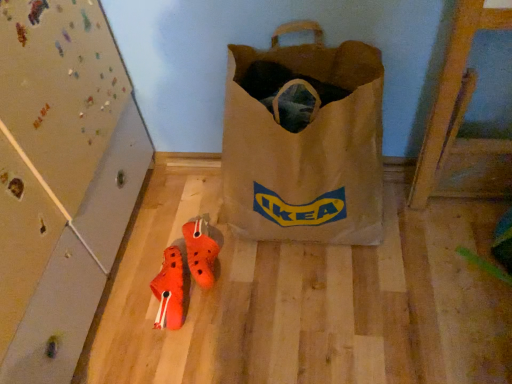
Find the location of a particular element. The image size is (512, 384). brown paper bag at center is located at coordinates (306, 148).

Considering the relative positions of brown paper bag at center and orange rubber clogs at center, the 1th footwear viewed from the right, in the image provided, is brown paper bag at center to the left or to the right of orange rubber clogs at center, the 1th footwear viewed from the right,?

brown paper bag at center is positioned on orange rubber clogs at center, the 1th footwear viewed from the right,'s right side.

Between brown paper bag at center and orange rubber clogs at center, the 2th footwear from the left, which one is positioned behind?

Positioned behind is orange rubber clogs at center, the 2th footwear from the left.

From the image's perspective, which one is positioned higher, brown paper bag at center or orange rubber clogs at center, the 1th footwear viewed from the right?

From the image's view, brown paper bag at center is above.

Identify the location of luggage and bags on the right of orange matte sneakers at lower center, arranged as the first footwear when viewed from the left. This screenshot has height=384, width=512. (306, 148).

Is brown paper bag at center positioned with its back to orange matte sneakers at lower center, placed as the second footwear when sorted from right to left?

brown paper bag at center does not have its back to orange matte sneakers at lower center, placed as the second footwear when sorted from right to left.

Which is more to the right, brown paper bag at center or orange matte sneakers at lower center, arranged as the first footwear when viewed from the left?

Positioned to the right is brown paper bag at center.

Considering the relative sizes of orange rubber clogs at center, the 2th footwear from the left, and orange matte sneakers at lower center, arranged as the first footwear when viewed from the left, in the image provided, is orange rubber clogs at center, the 2th footwear from the left, shorter than orange matte sneakers at lower center, arranged as the first footwear when viewed from the left,?

Yes.

Which is in front, orange rubber clogs at center, the 2th footwear from the left, or orange matte sneakers at lower center, arranged as the first footwear when viewed from the left?

Positioned in front is orange matte sneakers at lower center, arranged as the first footwear when viewed from the left.

Can we say orange rubber clogs at center, the 2th footwear from the left, lies outside orange matte sneakers at lower center, arranged as the first footwear when viewed from the left?

Absolutely, orange rubber clogs at center, the 2th footwear from the left, is external to orange matte sneakers at lower center, arranged as the first footwear when viewed from the left.

Is orange rubber clogs at center, the 2th footwear from the left, with orange matte sneakers at lower center, placed as the second footwear when sorted from right to left?

Yes, orange rubber clogs at center, the 2th footwear from the left, is beside orange matte sneakers at lower center, placed as the second footwear when sorted from right to left.

Looking at this image, is orange matte sneakers at lower center, arranged as the first footwear when viewed from the left, not inside brown paper bag at center?

Yes, orange matte sneakers at lower center, arranged as the first footwear when viewed from the left, is outside of brown paper bag at center.

Is orange matte sneakers at lower center, placed as the second footwear when sorted from right to left, positioned with its back to brown paper bag at center?

No, orange matte sneakers at lower center, placed as the second footwear when sorted from right to left,'s orientation is not away from brown paper bag at center.

Measure the distance from orange matte sneakers at lower center, arranged as the first footwear when viewed from the left, to brown paper bag at center.

orange matte sneakers at lower center, arranged as the first footwear when viewed from the left, is 15.94 inches from brown paper bag at center.

Which is more to the left, orange matte sneakers at lower center, placed as the second footwear when sorted from right to left, or brown paper bag at center?

orange matte sneakers at lower center, placed as the second footwear when sorted from right to left, is more to the left.

Does orange matte sneakers at lower center, placed as the second footwear when sorted from right to left, have a lesser height compared to orange rubber clogs at center, the 1th footwear viewed from the right?

Incorrect, the height of orange matte sneakers at lower center, placed as the second footwear when sorted from right to left, does not fall short of that of orange rubber clogs at center, the 1th footwear viewed from the right.

The width and height of the screenshot is (512, 384). There is a orange matte sneakers at lower center, placed as the second footwear when sorted from right to left. Identify the location of footwear above it (from a real-world perspective). (200, 251).

Does point (177, 287) lie behind point (201, 220)?

No, (177, 287) is in front of (201, 220).

Can you confirm if orange matte sneakers at lower center, arranged as the first footwear when viewed from the left, is positioned to the right of orange rubber clogs at center, the 2th footwear from the left?

No, orange matte sneakers at lower center, arranged as the first footwear when viewed from the left, is not to the right of orange rubber clogs at center, the 2th footwear from the left.

Does orange rubber clogs at center, the 2th footwear from the left, have a smaller size compared to brown paper bag at center?

Correct, orange rubber clogs at center, the 2th footwear from the left, occupies less space than brown paper bag at center.

Is orange rubber clogs at center, the 1th footwear viewed from the right, facing away from brown paper bag at center?

No, orange rubber clogs at center, the 1th footwear viewed from the right, is not facing away from brown paper bag at center.

Considering the sizes of orange rubber clogs at center, the 2th footwear from the left, and brown paper bag at center in the image, is orange rubber clogs at center, the 2th footwear from the left, wider or thinner than brown paper bag at center?

Clearly, orange rubber clogs at center, the 2th footwear from the left, has less width compared to brown paper bag at center.

Is orange rubber clogs at center, the 2th footwear from the left, at the left side of brown paper bag at center?

Correct, you'll find orange rubber clogs at center, the 2th footwear from the left, to the left of brown paper bag at center.

From the brown paper bag at center, count 2nd footwears backward and point to it. Please provide its 2D coordinates.

[(200, 251)]

There is a orange matte sneakers at lower center, arranged as the first footwear when viewed from the left. Where is `luggage and bags above it (from a real-world perspective)`? This screenshot has width=512, height=384. luggage and bags above it (from a real-world perspective) is located at coordinates (306, 148).

When comparing their distances from brown paper bag at center, does orange rubber clogs at center, the 2th footwear from the left, or orange matte sneakers at lower center, arranged as the first footwear when viewed from the left, seem closer?

orange rubber clogs at center, the 2th footwear from the left, is closer to brown paper bag at center.

From the image, which object appears to be farther from orange rubber clogs at center, the 2th footwear from the left, brown paper bag at center or orange matte sneakers at lower center, arranged as the first footwear when viewed from the left?

Based on the image, brown paper bag at center appears to be further to orange rubber clogs at center, the 2th footwear from the left.

From the image, which object appears to be nearer to orange matte sneakers at lower center, arranged as the first footwear when viewed from the left, brown paper bag at center or orange rubber clogs at center, the 1th footwear viewed from the right?

orange rubber clogs at center, the 1th footwear viewed from the right, is positioned closer to the anchor orange matte sneakers at lower center, arranged as the first footwear when viewed from the left.

Which object lies further to the anchor point brown paper bag at center, orange matte sneakers at lower center, placed as the second footwear when sorted from right to left, or orange rubber clogs at center, the 1th footwear viewed from the right?

Based on the image, orange matte sneakers at lower center, placed as the second footwear when sorted from right to left, appears to be further to brown paper bag at center.

Considering their positions, is orange matte sneakers at lower center, placed as the second footwear when sorted from right to left, positioned further to orange rubber clogs at center, the 2th footwear from the left, than brown paper bag at center?

brown paper bag at center is positioned further to the anchor orange rubber clogs at center, the 2th footwear from the left.

Estimate the real-world distances between objects in this image. Which object is further from orange matte sneakers at lower center, arranged as the first footwear when viewed from the left, orange rubber clogs at center, the 1th footwear viewed from the right, or brown paper bag at center?

The object further to orange matte sneakers at lower center, arranged as the first footwear when viewed from the left, is brown paper bag at center.

The height and width of the screenshot is (384, 512). What are the coordinates of `footwear between brown paper bag at center and orange matte sneakers at lower center, placed as the second footwear when sorted from right to left, vertically` in the screenshot? It's located at (200, 251).